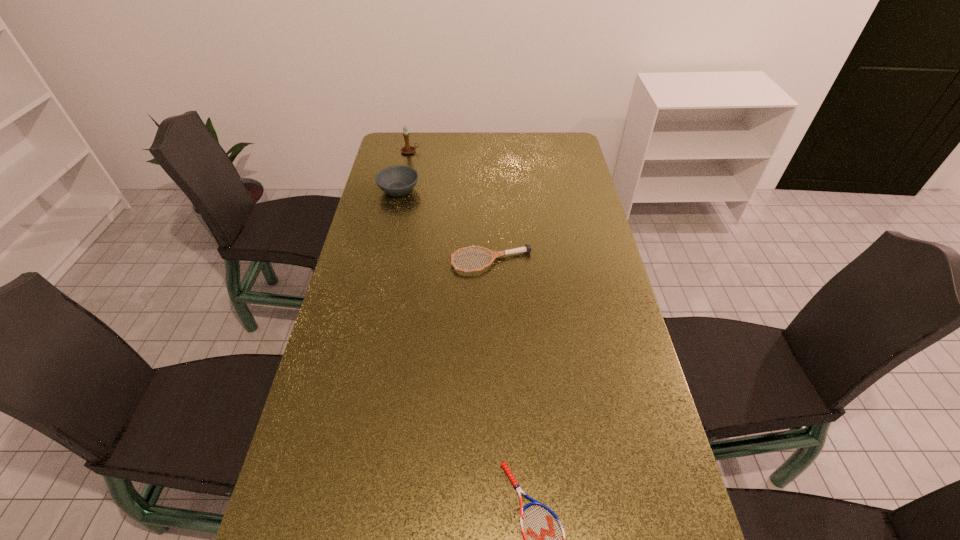
Find the location of a particular element. The width and height of the screenshot is (960, 540). candle holder that is positioned at the left edge is located at coordinates (407, 149).

At what (x,y) coordinates should I click in order to perform the action: click on soup bowl that is at the left edge. Please return your answer as a coordinate pair (x, y). The image size is (960, 540). Looking at the image, I should click on (398, 180).

Image resolution: width=960 pixels, height=540 pixels. In order to click on object that is at the far left corner in this screenshot , I will do `click(407, 149)`.

The height and width of the screenshot is (540, 960). What are the coordinates of `free space at the far edge of the desktop` in the screenshot? It's located at (472, 159).

Identify the location of free region at the left edge. The height and width of the screenshot is (540, 960). (396, 252).

At what (x,y) coordinates should I click in order to perform the action: click on vacant space at the right edge of the desktop. Please return your answer as a coordinate pair (x, y). Looking at the image, I should click on (603, 394).

Identify the location of free location at the far right corner. The width and height of the screenshot is (960, 540). (573, 152).

Identify the location of free space between the taller tennis racket and the farthest object. (451, 207).

This screenshot has width=960, height=540. I want to click on vacant point located between the soup bowl and the second shortest object, so click(x=445, y=226).

Identify the location of object that ranks as the third closest to the shorter tennis racket. The width and height of the screenshot is (960, 540). (407, 149).